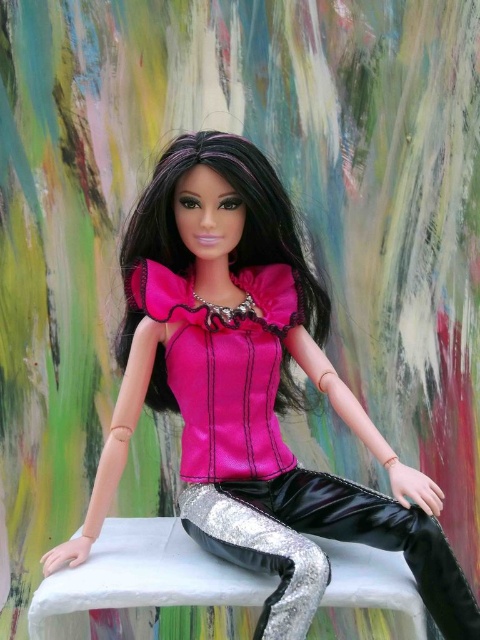
Does satin pink blouse at center come behind silver metallic pants at center?

Yes, satin pink blouse at center is behind silver metallic pants at center.

Can you confirm if satin pink blouse at center is positioned to the left of silver metallic pants at center?

Indeed, satin pink blouse at center is positioned on the left side of silver metallic pants at center.

Is point (88, 538) less distant than point (200, 522)?

No, (88, 538) is further to viewer.

You are a GUI agent. You are given a task and a screenshot of the screen. Output one action in this format:
    pyautogui.click(x=<x>, y=<y>)
    Task: Click on the satin pink blouse at center
    This screenshot has width=480, height=640.
    Given the screenshot: What is the action you would take?
    pyautogui.click(x=252, y=392)